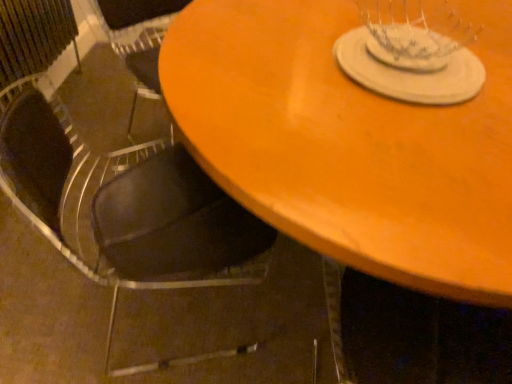
Question: From the image's perspective, is wooden table at center beneath black leather chair at lower left?

Choices:
 (A) no
 (B) yes

Answer: (A)

Question: Is black leather chair at lower left a part of wooden table at center?

Choices:
 (A) yes
 (B) no

Answer: (A)

Question: Does wooden table at center have a larger size compared to black leather chair at lower left?

Choices:
 (A) no
 (B) yes

Answer: (B)

Question: From the image's perspective, is wooden table at center on top of black leather chair at lower left?

Choices:
 (A) yes
 (B) no

Answer: (A)

Question: Is wooden table at center in front of black leather chair at lower left?

Choices:
 (A) yes
 (B) no

Answer: (A)

Question: From a real-world perspective, does wooden table at center sit lower than black leather chair at lower left?

Choices:
 (A) no
 (B) yes

Answer: (B)

Question: Is wooden table at center completely or partially outside of white matte glass plate at upper center?

Choices:
 (A) no
 (B) yes

Answer: (B)

Question: Is wooden table at center wider than white matte glass plate at upper center?

Choices:
 (A) no
 (B) yes

Answer: (B)

Question: Is wooden table at center looking in the opposite direction of white matte glass plate at upper center?

Choices:
 (A) yes
 (B) no

Answer: (B)

Question: Can you confirm if wooden table at center is thinner than white matte glass plate at upper center?

Choices:
 (A) no
 (B) yes

Answer: (A)

Question: From a real-world perspective, is wooden table at center over white matte glass plate at upper center?

Choices:
 (A) yes
 (B) no

Answer: (B)

Question: Is wooden table at center aimed at white matte glass plate at upper center?

Choices:
 (A) no
 (B) yes

Answer: (A)

Question: Can you see black leather chair at lower left touching wooden table at center?

Choices:
 (A) yes
 (B) no

Answer: (B)